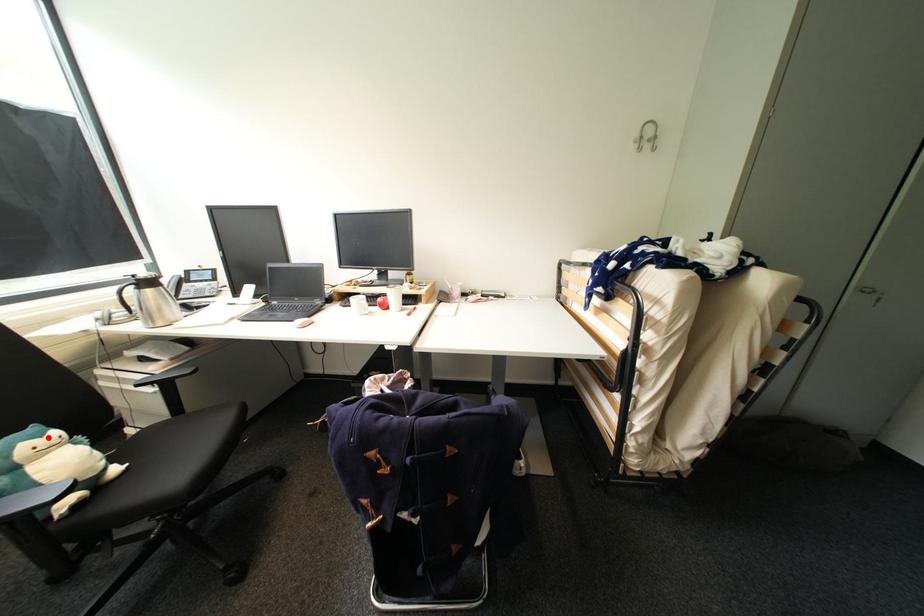
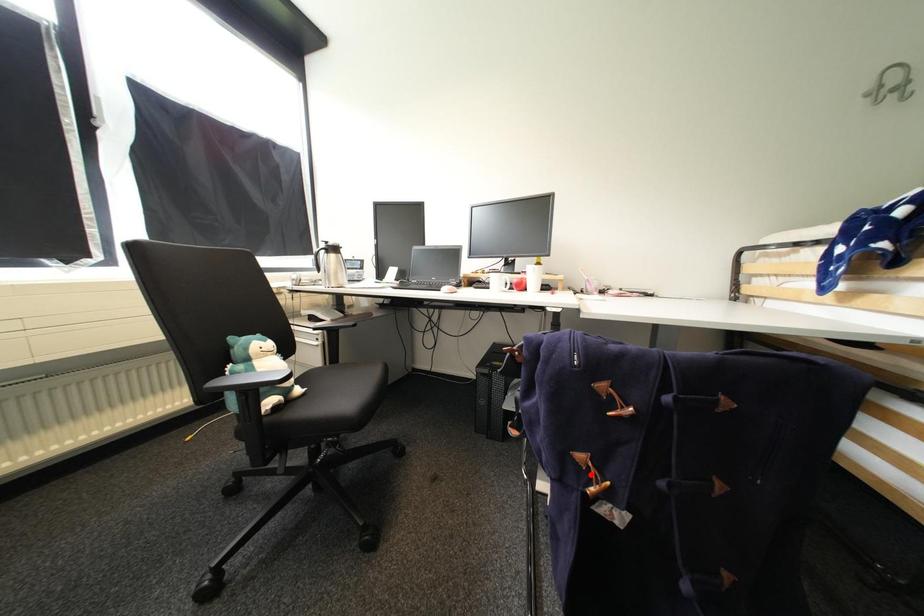
I am providing you with two images of the same scene from different viewpoints. A red point is marked on the first image and another point is marked on the second image. Are the points marked in image1 and image2 representing the same 3D position?

No